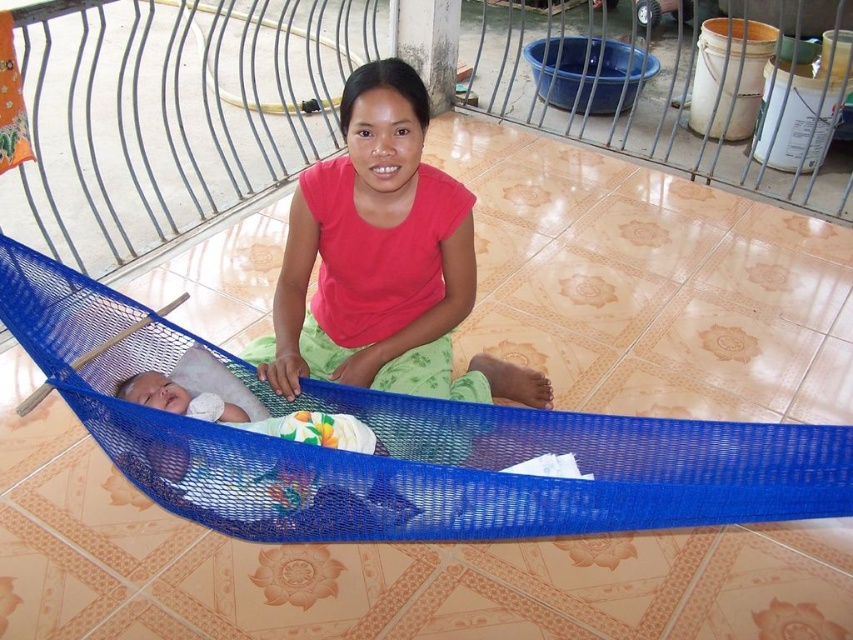
Is blue mesh hammock at center closer to camera compared to white soft baby at lower left?

Yes, blue mesh hammock at center is closer to the viewer.

Is blue mesh hammock at center further to the viewer compared to white soft baby at lower left?

No, blue mesh hammock at center is in front of white soft baby at lower left.

The image size is (853, 640). In order to click on blue mesh hammock at center in this screenshot , I will do `click(405, 445)`.

Between white soft baby at center and white soft baby at lower left, which one has more height?

Standing taller between the two is white soft baby at center.

What do you see at coordinates (381, 260) in the screenshot?
I see `white soft baby at center` at bounding box center [381, 260].

Image resolution: width=853 pixels, height=640 pixels. In order to click on white soft baby at center in this screenshot , I will do `click(381, 260)`.

Is blue mesh hammock at center behind white soft diaper at center?

No, it is not.

Between point (134, 420) and point (190, 403), which one is positioned in front?

Point (134, 420) is more forward.

Is point (482, 493) farther from viewer compared to point (193, 401)?

No, it is in front of (193, 401).

Locate an element on the screen. blue mesh hammock at center is located at coordinates (405, 445).